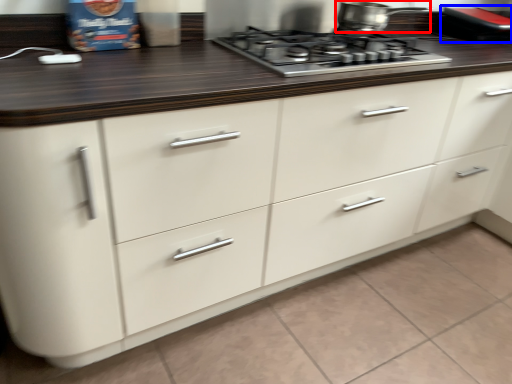
Question: Which object appears farthest to the camera in this image, kitchen appliance (highlighted by a red box) or appliance (highlighted by a blue box)?

Choices:
 (A) kitchen appliance
 (B) appliance

Answer: (B)